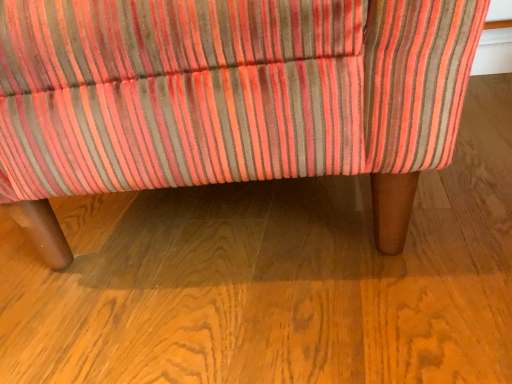
Question: Should I look upward or downward to see velvet striped chair at center?

Choices:
 (A) up
 (B) down

Answer: (A)